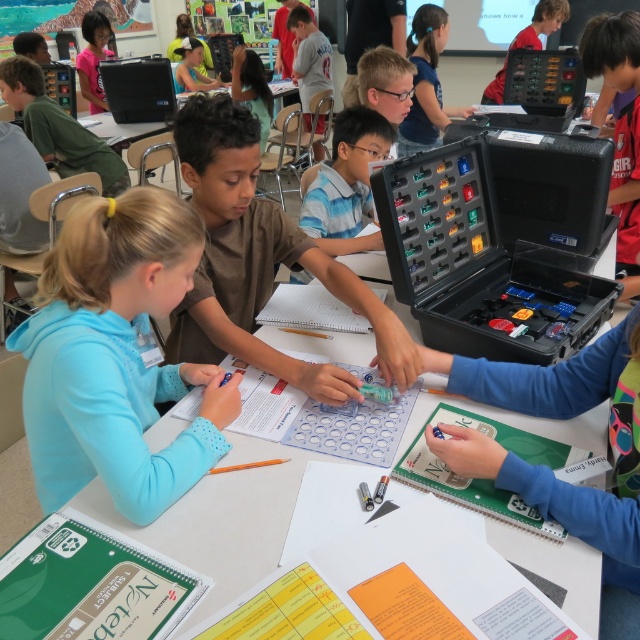
Looking at this image, you are a student trying to locate the black plastic toolbox at center during a science activity. Based on the coordinates provided, where exactly would you find it in the classroom?

The black plastic toolbox at center is located at point (497, 244) in the classroom.